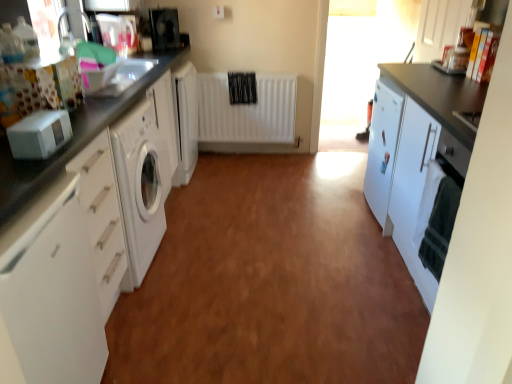
Question: Considering the relative sizes of white matte cabinet at right, arranged as the 3th cabinetry when viewed from the left, and transparent glass window screen at upper right in the image provided, is white matte cabinet at right, arranged as the 3th cabinetry when viewed from the left, shorter than transparent glass window screen at upper right?

Choices:
 (A) no
 (B) yes

Answer: (B)

Question: Is white matte cabinet at right, arranged as the 3th cabinetry when viewed from the left, thinner than transparent glass window screen at upper right?

Choices:
 (A) yes
 (B) no

Answer: (B)

Question: Could you tell me if white matte cabinet at right, arranged as the 3th cabinetry when viewed from the left, is turned towards transparent glass window screen at upper right?

Choices:
 (A) no
 (B) yes

Answer: (A)

Question: Does white matte cabinet at right, arranged as the 3th cabinetry when viewed from the left, appear on the right side of transparent glass window screen at upper right?

Choices:
 (A) no
 (B) yes

Answer: (B)

Question: Is transparent glass window screen at upper right completely or partially inside white matte cabinet at right, the second cabinetry in the right-to-left sequence?

Choices:
 (A) yes
 (B) no

Answer: (B)

Question: Considering the positions of point (29, 134) and point (382, 170), is point (29, 134) closer or farther from the camera than point (382, 170)?

Choices:
 (A) farther
 (B) closer

Answer: (B)

Question: From the image's perspective, is white matte microwave at left, which is counted as the first appliance, starting from the bottom, above or below white matte cabinet at right, the second cabinetry in the right-to-left sequence?

Choices:
 (A) below
 (B) above

Answer: (B)

Question: In terms of height, does white matte microwave at left, which is counted as the first appliance, starting from the bottom, look taller or shorter compared to white matte cabinet at right, arranged as the 3th cabinetry when viewed from the left?

Choices:
 (A) tall
 (B) short

Answer: (B)

Question: From a real-world perspective, is white matte microwave at left, which is counted as the first appliance, starting from the bottom, physically located above or below white matte cabinet at right, the second cabinetry in the right-to-left sequence?

Choices:
 (A) above
 (B) below

Answer: (A)

Question: Is white matte microwave at left, acting as the second appliance starting from the back, situated inside white glossy cabinet at left, arranged as the fourth cabinetry when viewed from the right, or outside?

Choices:
 (A) outside
 (B) inside

Answer: (A)

Question: From a real-world perspective, is white matte microwave at left, the second appliance from the top, above or below white glossy cabinet at left, acting as the first cabinetry starting from the left?

Choices:
 (A) above
 (B) below

Answer: (A)

Question: Considering the positions of white matte microwave at left, positioned as the first appliance in front-to-back order, and white glossy cabinet at left, arranged as the fourth cabinetry when viewed from the right, in the image, is white matte microwave at left, positioned as the first appliance in front-to-back order, bigger or smaller than white glossy cabinet at left, arranged as the fourth cabinetry when viewed from the right,?

Choices:
 (A) small
 (B) big

Answer: (A)

Question: Considering the positions of point (42, 122) and point (74, 140), is point (42, 122) closer or farther from the camera than point (74, 140)?

Choices:
 (A) closer
 (B) farther

Answer: (A)

Question: Is point (267, 107) positioned closer to the camera than point (390, 6)?

Choices:
 (A) closer
 (B) farther

Answer: (A)

Question: From a real-world perspective, is white matte radiator at center above or below transparent glass window screen at upper right?

Choices:
 (A) above
 (B) below

Answer: (B)